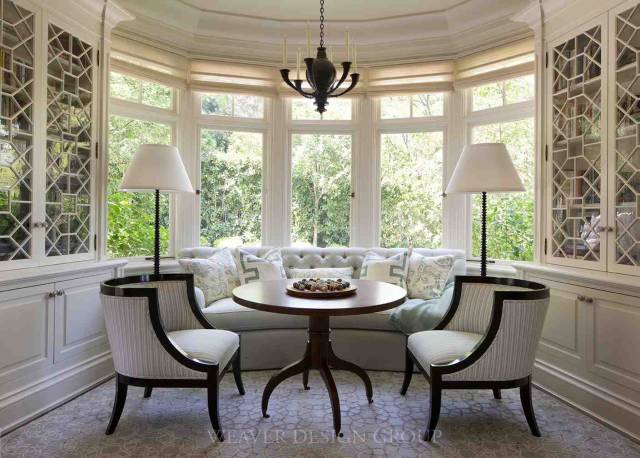
The height and width of the screenshot is (458, 640). In order to click on chandelier in this screenshot , I will do pos(307,81).